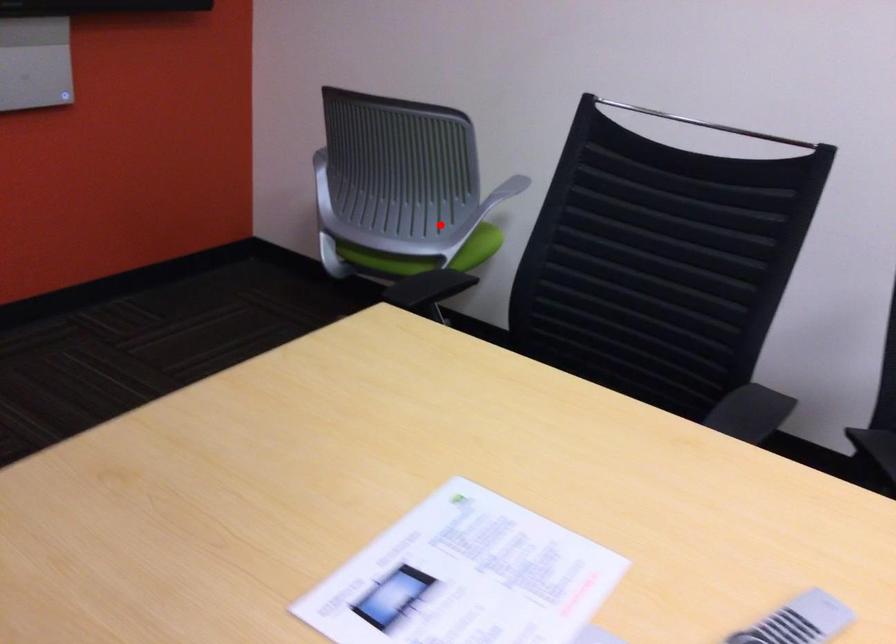
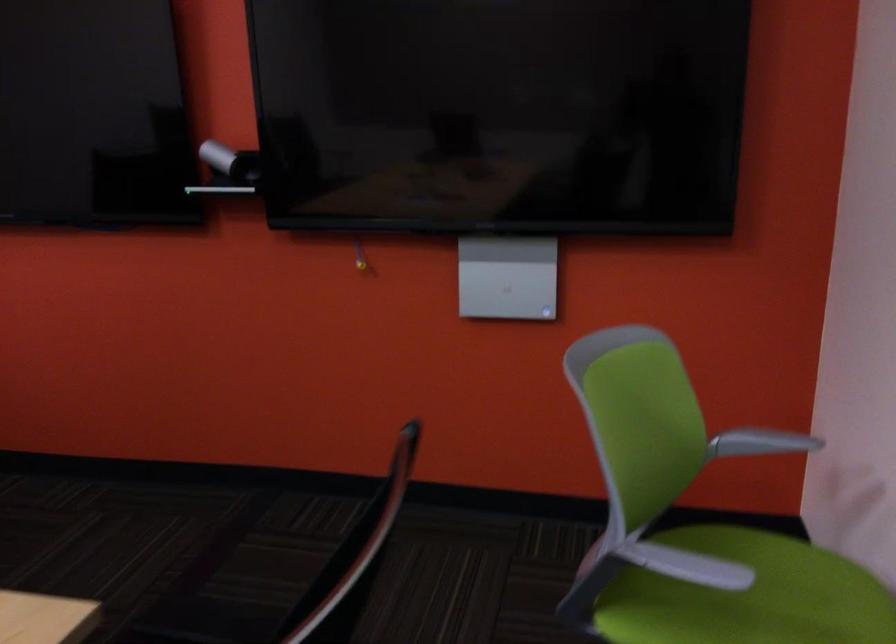
Question: I am providing you with two images of the same scene from different viewpoints. Image1 has a red point marked. In image2, the corresponding 3D location appears at what relative position? Reply with the corresponding letter.

Choices:
 (A) Closer
 (B) Farther

Answer: (A)